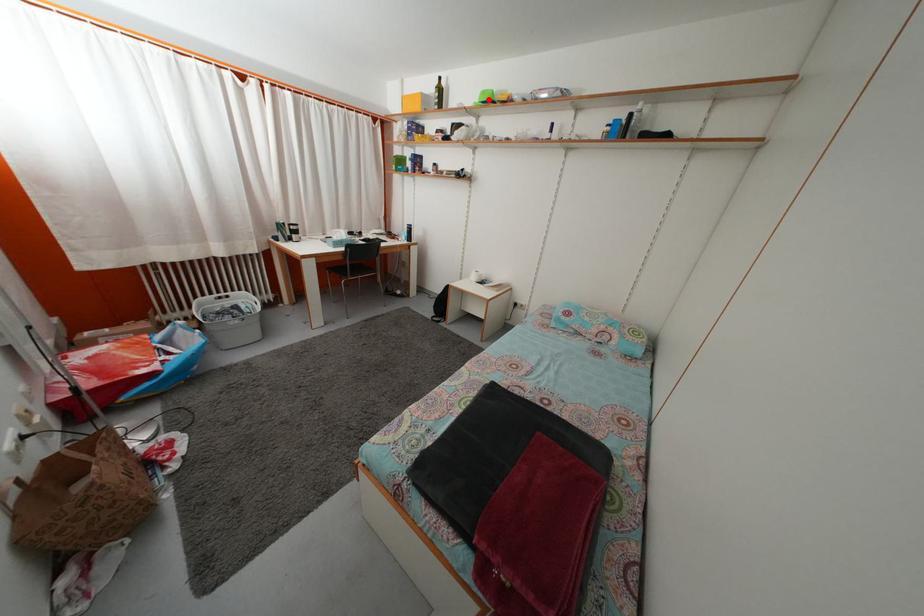
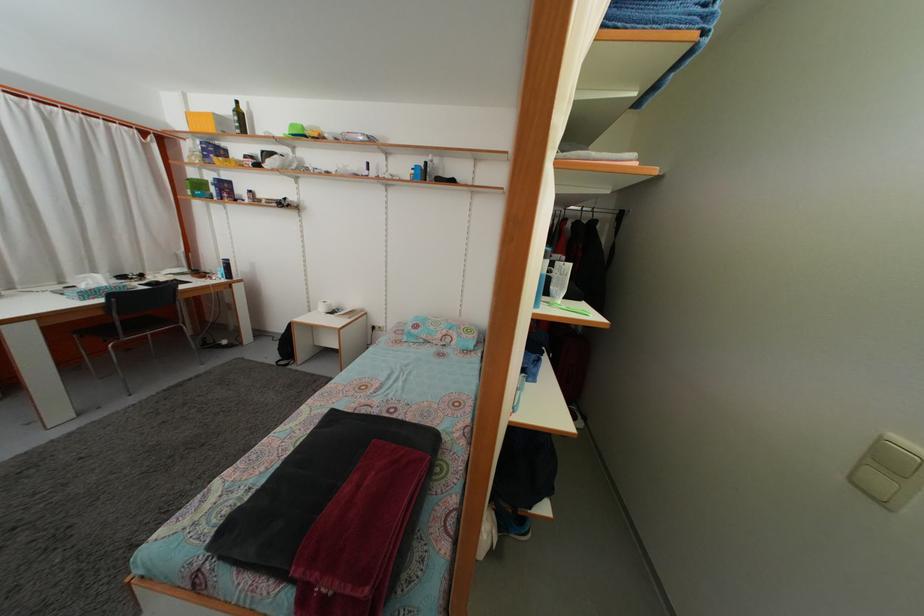
Where in the second image is the point corresponding to the highlighted location from the first image?

(298, 132)